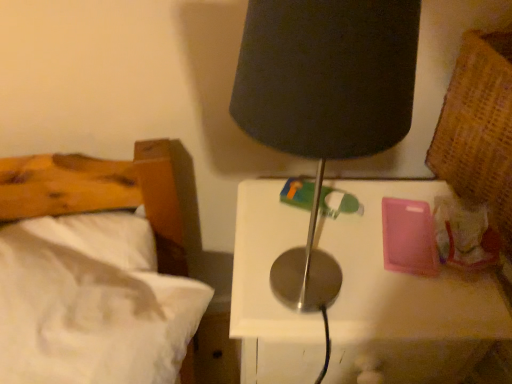
Where is `vacant space behind black fabric lamp at upper center`? This screenshot has width=512, height=384. vacant space behind black fabric lamp at upper center is located at coordinates (298, 213).